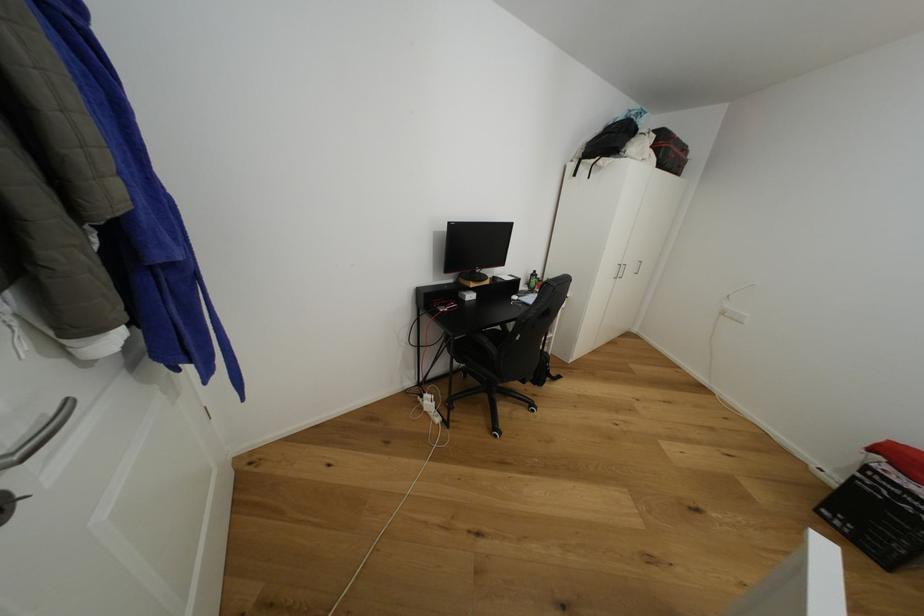
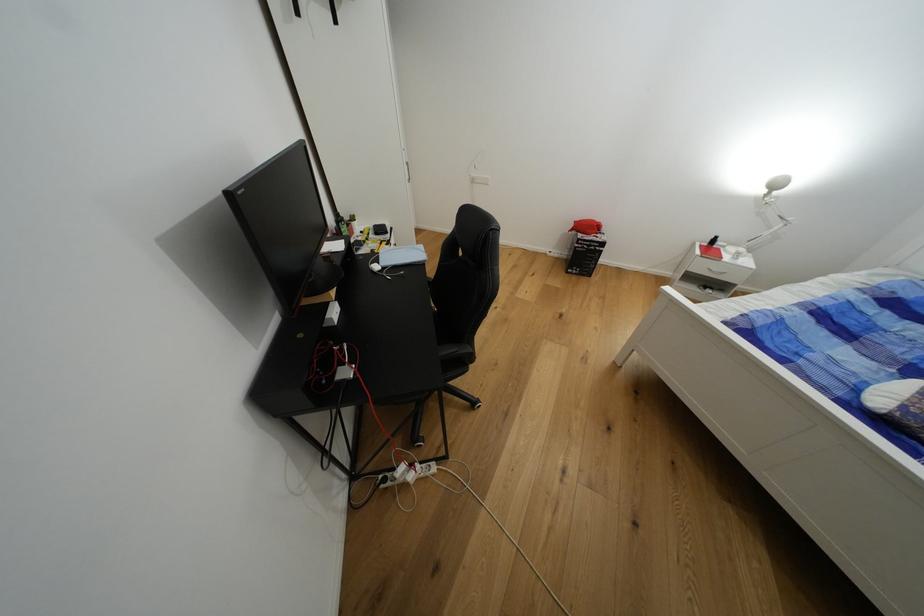
Where in the second image is the point corresponding to (x=491, y=342) from the first image?

(460, 351)